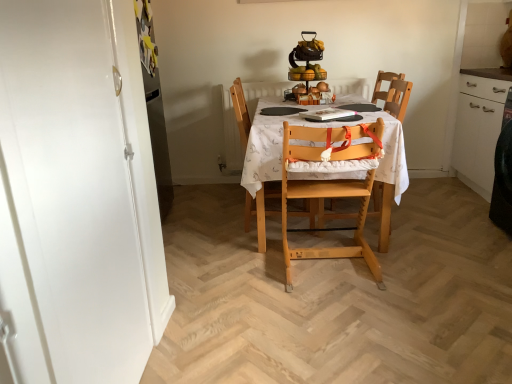
Locate an element on the screen. free point below light wood highchair at center, which is counted as the second chair, starting from the left (from a real-world perspective) is located at coordinates (332, 266).